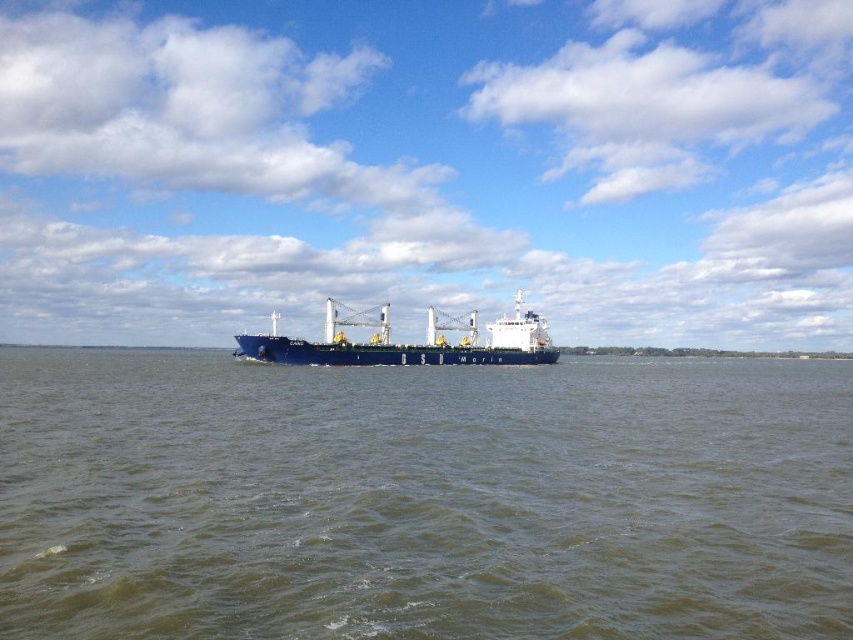
Question: Is brown water at center above blue matte cargo ship at center?

Choices:
 (A) no
 (B) yes

Answer: (A)

Question: Among these points, which one is farthest from the camera?

Choices:
 (A) (283, 474)
 (B) (355, 353)

Answer: (B)

Question: Is brown water at center smaller than blue matte cargo ship at center?

Choices:
 (A) no
 (B) yes

Answer: (B)

Question: From the image, what is the correct spatial relationship of brown water at center in relation to blue matte cargo ship at center?

Choices:
 (A) above
 (B) below

Answer: (B)